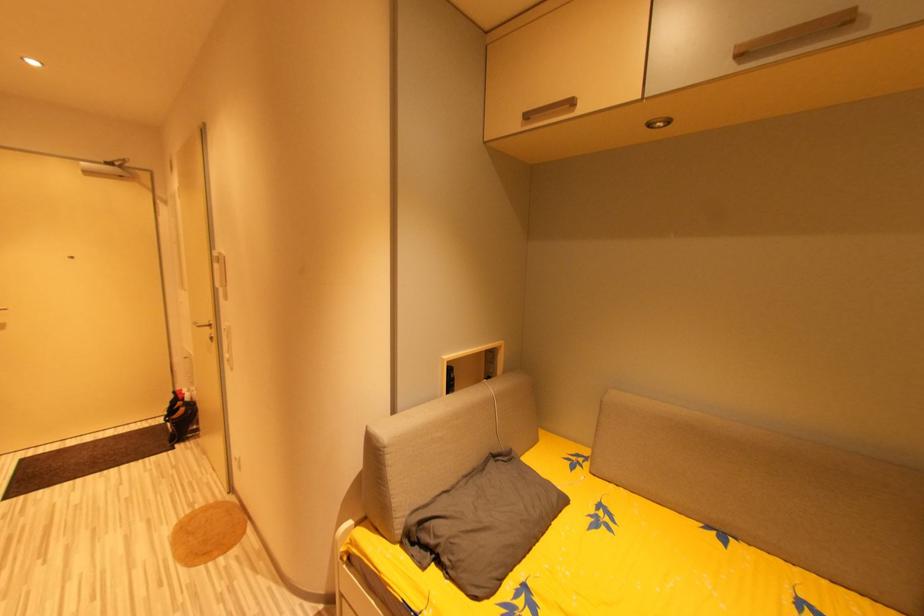
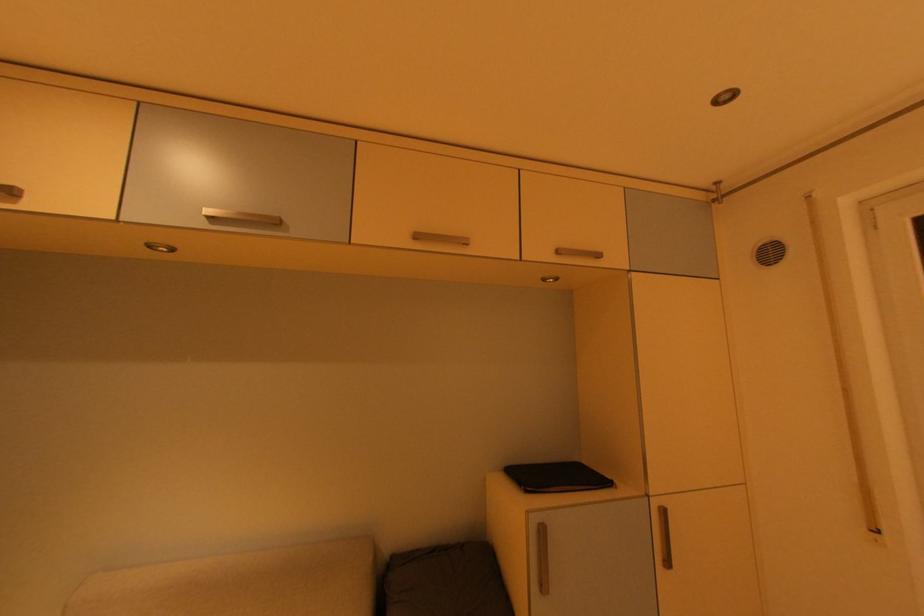
Question: The camera is either moving clockwise (left) or counter-clockwise (right) around the object. The first image is from the beginning of the video and the second image is from the end. Is the camera moving left or right when shooting the video?

Choices:
 (A) Left
 (B) Right

Answer: (A)